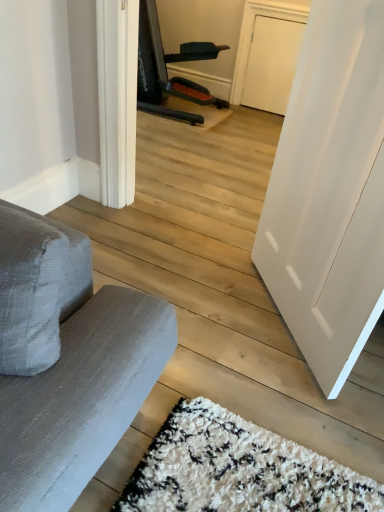
Locate an element on the screen. This screenshot has height=512, width=384. gray fabric armchair at upper left is located at coordinates (167, 72).

Describe the element at coordinates (167, 72) in the screenshot. The width and height of the screenshot is (384, 512). I see `gray fabric armchair at upper left` at that location.

What is the approximate height of white smooth door at right?

The height of white smooth door at right is 1.13 meters.

Consider the image. What is the approximate width of white smooth door at right?

It is 6.45 inches.

This screenshot has height=512, width=384. What are the coordinates of `white smooth door at right` in the screenshot? It's located at (x=330, y=192).

This screenshot has width=384, height=512. Describe the element at coordinates (330, 192) in the screenshot. I see `white smooth door at right` at that location.

Identify the location of gray fabric armchair at upper left. (167, 72).

Which object is positioned more to the left, white smooth door at right or gray fabric armchair at upper left?

From the viewer's perspective, gray fabric armchair at upper left appears more on the left side.

Which is behind, white smooth door at right or gray fabric armchair at upper left?

Positioned behind is gray fabric armchair at upper left.

Which is closer, (320, 53) or (196, 98)?

Point (320, 53) is closer to the camera than point (196, 98).

From the image's perspective, would you say white smooth door at right is shown under gray fabric armchair at upper left?

Yes, from the image's perspective, white smooth door at right is below gray fabric armchair at upper left.

From a real-world perspective, who is located higher, white smooth door at right or gray fabric armchair at upper left?

white smooth door at right, from a real-world perspective.

Can you confirm if white smooth door at right is thinner than gray fabric armchair at upper left?

Correct, the width of white smooth door at right is less than that of gray fabric armchair at upper left.

Can you confirm if white smooth door at right is taller than gray fabric armchair at upper left?

Correct, white smooth door at right is much taller as gray fabric armchair at upper left.

Which of these two, white smooth door at right or gray fabric armchair at upper left, is smaller?

With smaller size is white smooth door at right.

Is white smooth door at right not within gray fabric armchair at upper left?

white smooth door at right is positioned outside gray fabric armchair at upper left.

Is white smooth door at right with gray fabric armchair at upper left?

No, white smooth door at right is not touching gray fabric armchair at upper left.

Is white smooth door at right aimed at gray fabric armchair at upper left?

No.

How many degrees apart are the facing directions of white smooth door at right and gray fabric armchair at upper left?

The angular difference between white smooth door at right and gray fabric armchair at upper left is 51.6 degrees.

Locate an element on the screen. The image size is (384, 512). door above the gray fabric armchair at upper left (from a real-world perspective) is located at coordinates (330, 192).

Considering the relative positions of gray fabric armchair at upper left and white smooth door at right in the image provided, is gray fabric armchair at upper left to the left of white smooth door at right from the viewer's perspective?

Yes, gray fabric armchair at upper left is to the left of white smooth door at right.

In the image, is gray fabric armchair at upper left positioned in front of or behind white smooth door at right?

Clearly, gray fabric armchair at upper left is behind white smooth door at right.

Does point (180, 112) appear closer or farther from the camera than point (279, 249)?

Clearly, point (180, 112) is more distant from the camera than point (279, 249).

From the image's perspective, does gray fabric armchair at upper left appear lower than white smooth door at right?

No, from the image's perspective, gray fabric armchair at upper left is not below white smooth door at right.

From a real-world perspective, who is located lower, gray fabric armchair at upper left or white smooth door at right?

gray fabric armchair at upper left is physically lower.

Which object is thinner, gray fabric armchair at upper left or white smooth door at right?

white smooth door at right.

From their relative heights in the image, would you say gray fabric armchair at upper left is taller or shorter than white smooth door at right?

Considering their sizes, gray fabric armchair at upper left has less height than white smooth door at right.

In the scene shown: Does gray fabric armchair at upper left have a larger size compared to white smooth door at right?

Indeed, gray fabric armchair at upper left has a larger size compared to white smooth door at right.

Would you say gray fabric armchair at upper left is outside white smooth door at right?

That's correct, gray fabric armchair at upper left is outside of white smooth door at right.

Would you consider gray fabric armchair at upper left to be distant from white smooth door at right?

Yes, gray fabric armchair at upper left and white smooth door at right are located far from each other.

Is gray fabric armchair at upper left oriented away from white smooth door at right?

That's not correct — gray fabric armchair at upper left is not looking away from white smooth door at right.

What's the angular difference between gray fabric armchair at upper left and white smooth door at right's facing directions?

51.6 degrees separate the facing orientations of gray fabric armchair at upper left and white smooth door at right.

This screenshot has width=384, height=512. Identify the location of armchair located behind the white smooth door at right. (167, 72).

Where is `armchair below the white smooth door at right (from a real-world perspective)`? The image size is (384, 512). armchair below the white smooth door at right (from a real-world perspective) is located at coordinates (167, 72).

Where is `door to the right of gray fabric armchair at upper left`? Image resolution: width=384 pixels, height=512 pixels. door to the right of gray fabric armchair at upper left is located at coordinates (330, 192).